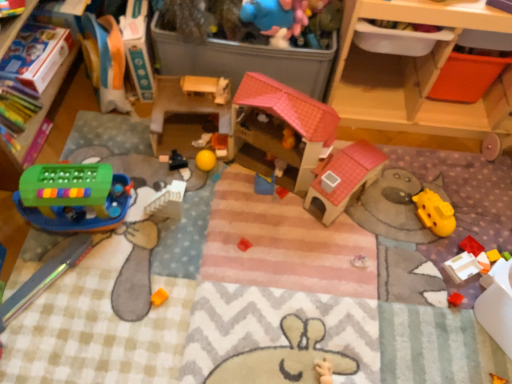
Where is `vacant area on the back side of green plastic boat at left, the 1th toy viewed from the left`? vacant area on the back side of green plastic boat at left, the 1th toy viewed from the left is located at coordinates (108, 151).